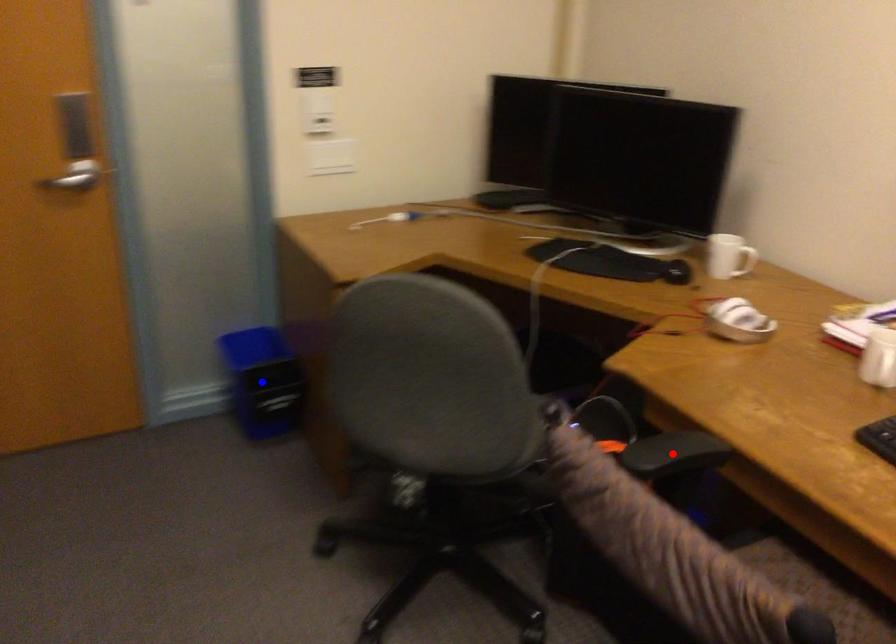
Question: Two points are marked on the image. Which point is closer to the camera?

Choices:
 (A) Blue point is closer.
 (B) Red point is closer.

Answer: (B)